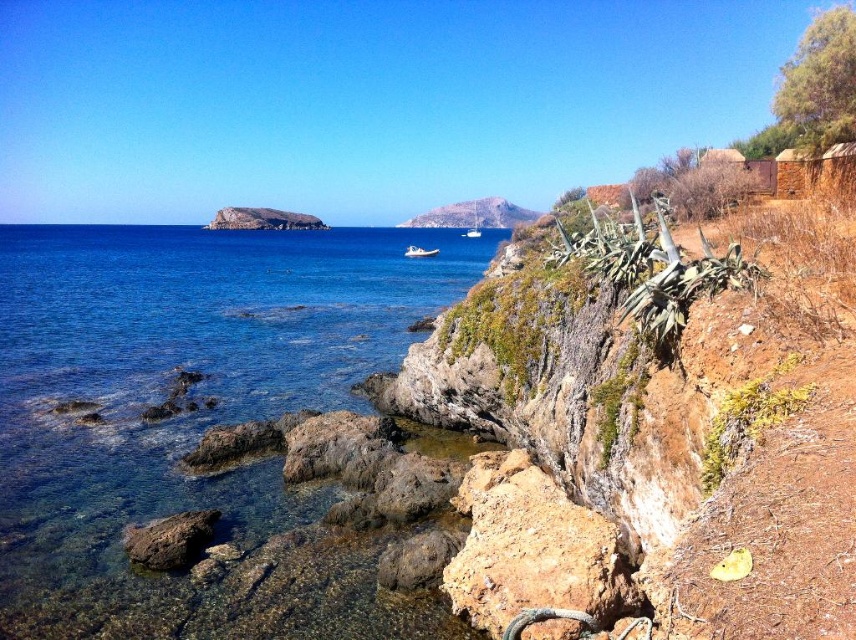
You are standing at the center of the image and want to move towards the brown rough rock at lower center. Based on its position, in which direction should you walk?

The brown rough rock at lower center is located at point coordinates, so you should walk downward from the center to reach it.

You are a hiker standing at the edge of the rocky terrain. You see the brown rough rock at lower left and the white rubber boat at center. Which object is nearer to you?

The brown rough rock at lower left is closer to the viewer than the white rubber boat at center.